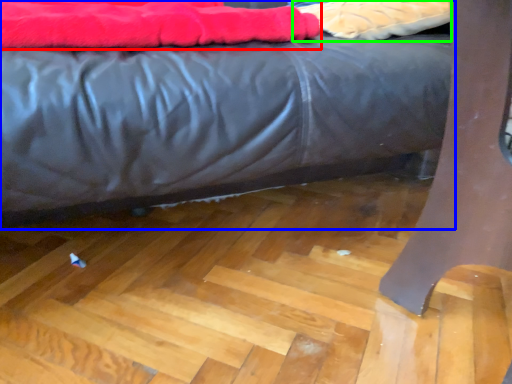
Question: Based on their relative distances, which object is nearer to blanket (highlighted by a red box)? Choose from bed (highlighted by a blue box) and material (highlighted by a green box).

Choices:
 (A) bed
 (B) material

Answer: (A)